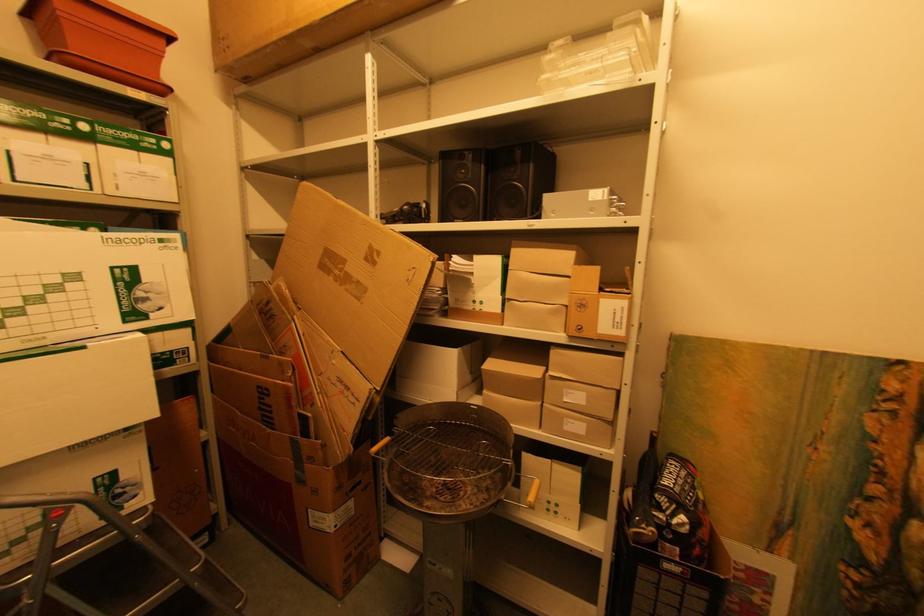
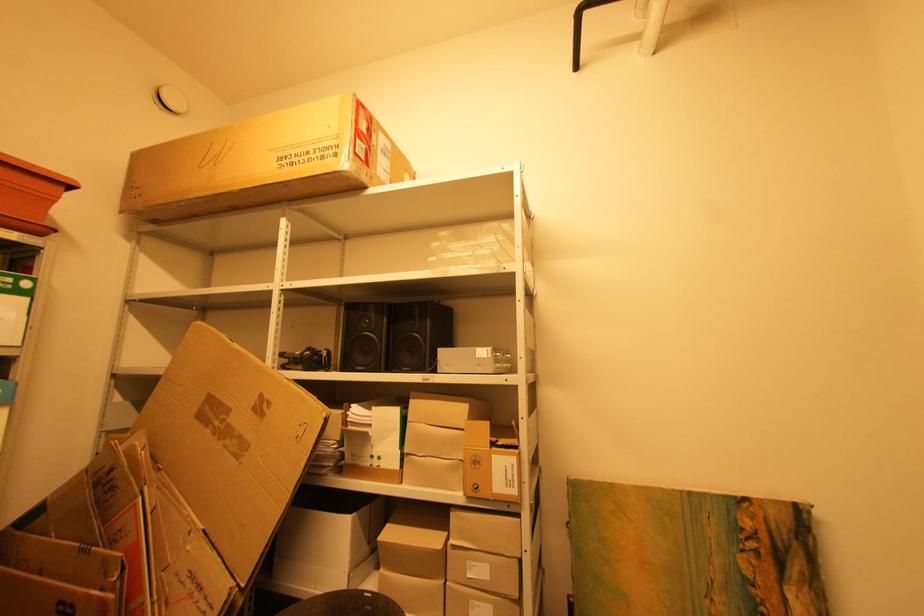
Question: Based on the continuous images, in which direction is the camera rotating? Reply with the corresponding letter.

Choices:
 (A) Left
 (B) Right
 (C) Up
 (D) Down

Answer: (C)